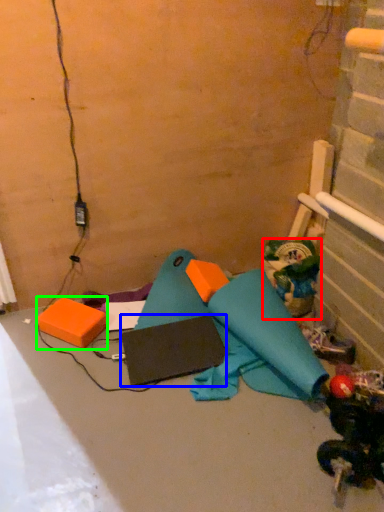
Question: Based on their relative distances, which object is farther from toy (highlighted by a red box)? Choose from pad (highlighted by a blue box) and box (highlighted by a green box).

Choices:
 (A) pad
 (B) box

Answer: (B)